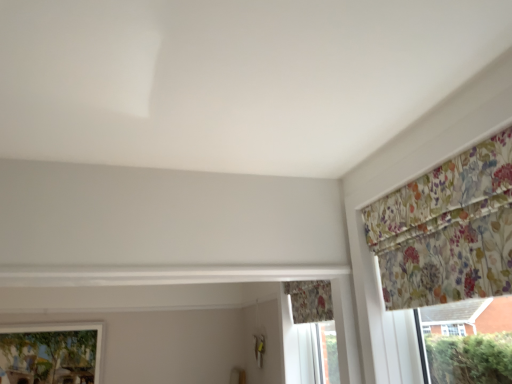
This screenshot has height=384, width=512. What do you see at coordinates (51, 353) in the screenshot?
I see `matte glass window at lower left` at bounding box center [51, 353].

Find the location of `matte glass window at lower left`. matte glass window at lower left is located at coordinates (51, 353).

Which of these two, floral fabric curtain at lower center, marked as the 2th curtain in a right-to-left arrangement, or matte glass window at lower left, is smaller?

With smaller size is floral fabric curtain at lower center, marked as the 2th curtain in a right-to-left arrangement.

Is point (331, 296) closer or farther from the camera than point (60, 335)?

Clearly, point (331, 296) is closer to the camera than point (60, 335).

This screenshot has width=512, height=384. I want to click on window that is under the floral fabric curtain at lower center, marked as the 2th curtain in a right-to-left arrangement (from a real-world perspective), so [51, 353].

From the image's perspective, is matte glass window at lower left under floral fabric curtain at upper right, the first curtain positioned from the right?

Yes, from the image's perspective, matte glass window at lower left is below floral fabric curtain at upper right, the first curtain positioned from the right.

Is point (40, 331) closer or farther from the camera than point (455, 268)?

Clearly, point (40, 331) is more distant from the camera than point (455, 268).

From a real-world perspective, is matte glass window at lower left positioned above or below floral fabric curtain at upper right, acting as the 2th curtain starting from the left?

matte glass window at lower left is situated lower than floral fabric curtain at upper right, acting as the 2th curtain starting from the left, in the real world.

Is matte glass window at lower left facing towards floral fabric curtain at lower center, which is the second curtain in top-to-bottom order?

No.

Between matte glass window at lower left and floral fabric curtain at lower center, marked as the 2th curtain in a right-to-left arrangement, which one has more height?

matte glass window at lower left.

Is matte glass window at lower left further to the viewer compared to floral fabric curtain at lower center, which ranks as the first curtain in bottom-to-top order?

Yes, matte glass window at lower left is behind floral fabric curtain at lower center, which ranks as the first curtain in bottom-to-top order.

Relative to matte glass window at lower left, is floral fabric curtain at upper right, positioned as the 1th curtain in top-to-bottom order, in front or behind?

floral fabric curtain at upper right, positioned as the 1th curtain in top-to-bottom order, is in front of matte glass window at lower left.

From the image's perspective, would you say floral fabric curtain at upper right, marked as the first curtain in a front-to-back arrangement, is positioned over matte glass window at lower left?

Yes.

Identify the location of the 2nd curtain directly above the matte glass window at lower left (from a real-world perspective). Image resolution: width=512 pixels, height=384 pixels. (447, 230).

Which is more to the right, floral fabric curtain at upper right, which ranks as the 2th curtain in back-to-front order, or matte glass window at lower left?

From the viewer's perspective, floral fabric curtain at upper right, which ranks as the 2th curtain in back-to-front order, appears more on the right side.

Is floral fabric curtain at upper right, the first curtain positioned from the right, inside or outside of floral fabric curtain at lower center, placed as the first curtain when sorted from left to right?

floral fabric curtain at upper right, the first curtain positioned from the right, is not enclosed by floral fabric curtain at lower center, placed as the first curtain when sorted from left to right.

Considering the sizes of objects floral fabric curtain at upper right, acting as the 2th curtain starting from the left, and floral fabric curtain at lower center, which ranks as the 1th curtain in back-to-front order, in the image provided, who is shorter, floral fabric curtain at upper right, acting as the 2th curtain starting from the left, or floral fabric curtain at lower center, which ranks as the 1th curtain in back-to-front order,?

With less height is floral fabric curtain at lower center, which ranks as the 1th curtain in back-to-front order.

Can you confirm if floral fabric curtain at upper right, marked as the first curtain in a front-to-back arrangement, is smaller than floral fabric curtain at lower center, which is the second curtain in top-to-bottom order?

Incorrect, floral fabric curtain at upper right, marked as the first curtain in a front-to-back arrangement, is not smaller in size than floral fabric curtain at lower center, which is the second curtain in top-to-bottom order.

Does point (397, 254) lie in front of point (327, 319)?

Yes.

Does floral fabric curtain at lower center, placed as the first curtain when sorted from left to right, touch floral fabric curtain at upper right, marked as the first curtain in a front-to-back arrangement?

No, floral fabric curtain at lower center, placed as the first curtain when sorted from left to right, is not beside floral fabric curtain at upper right, marked as the first curtain in a front-to-back arrangement.

In order to click on curtain that is below the floral fabric curtain at upper right, the 2th curtain when ordered from bottom to top (from the image's perspective) in this screenshot , I will do `click(310, 300)`.

Which point is more forward, (311, 320) or (393, 200)?

The point (393, 200) is more forward.

Where is `window located underneath the floral fabric curtain at lower center, marked as the 2th curtain in a right-to-left arrangement (from a real-world perspective)`? window located underneath the floral fabric curtain at lower center, marked as the 2th curtain in a right-to-left arrangement (from a real-world perspective) is located at coordinates (51, 353).

At what (x,y) coordinates should I click in order to perform the action: click on the 2nd curtain in front of the matte glass window at lower left. Please return your answer as a coordinate pair (x, y). Looking at the image, I should click on (447, 230).

Considering their positions, is floral fabric curtain at upper right, the first curtain positioned from the right, positioned further to matte glass window at lower left than floral fabric curtain at lower center, which ranks as the first curtain in bottom-to-top order?

floral fabric curtain at upper right, the first curtain positioned from the right.

When comparing their distances from matte glass window at lower left, does floral fabric curtain at lower center, marked as the 2th curtain in a right-to-left arrangement, or floral fabric curtain at upper right, marked as the first curtain in a front-to-back arrangement, seem closer?

floral fabric curtain at lower center, marked as the 2th curtain in a right-to-left arrangement.

Estimate the real-world distances between objects in this image. Which object is closer to floral fabric curtain at lower center, marked as the 2th curtain in a right-to-left arrangement, floral fabric curtain at upper right, the 2th curtain when ordered from bottom to top, or matte glass window at lower left?

Based on the image, floral fabric curtain at upper right, the 2th curtain when ordered from bottom to top, appears to be nearer to floral fabric curtain at lower center, marked as the 2th curtain in a right-to-left arrangement.

Which object lies nearer to the anchor point floral fabric curtain at upper right, positioned as the 1th curtain in top-to-bottom order, floral fabric curtain at lower center, which is the second curtain in top-to-bottom order, or matte glass window at lower left?

floral fabric curtain at lower center, which is the second curtain in top-to-bottom order.

Considering their positions, is matte glass window at lower left positioned closer to floral fabric curtain at lower center, which ranks as the 1th curtain in back-to-front order, than floral fabric curtain at upper right, acting as the 2th curtain starting from the left?

floral fabric curtain at upper right, acting as the 2th curtain starting from the left, is positioned closer to the anchor floral fabric curtain at lower center, which ranks as the 1th curtain in back-to-front order.

Which object lies nearer to the anchor point floral fabric curtain at upper right, the 2th curtain when ordered from bottom to top, matte glass window at lower left or floral fabric curtain at lower center, which is the second curtain in top-to-bottom order?

floral fabric curtain at lower center, which is the second curtain in top-to-bottom order, lies closer to floral fabric curtain at upper right, the 2th curtain when ordered from bottom to top, than the other object.

Where is `curtain situated between matte glass window at lower left and floral fabric curtain at upper right, marked as the first curtain in a front-to-back arrangement, from left to right`? Image resolution: width=512 pixels, height=384 pixels. curtain situated between matte glass window at lower left and floral fabric curtain at upper right, marked as the first curtain in a front-to-back arrangement, from left to right is located at coordinates pyautogui.click(x=310, y=300).